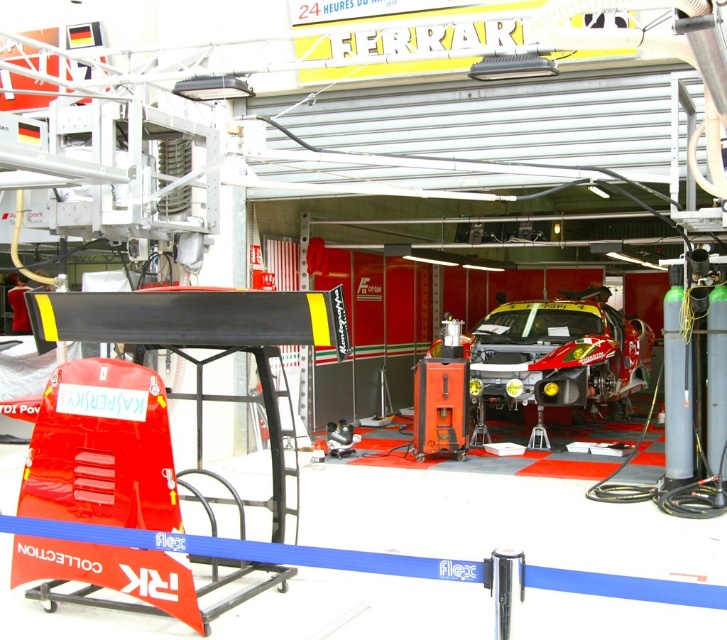
You are a photographer trying to capture a shot of the shiny silver car at center and the metallic silver mechanic at center. Since both are silver, you want to ensure the car is clearly visible in the photo. Based on their positions, which object should you focus on to make sure the car stands out?

The shiny silver car at center is positioned on the right side of the metallic silver mechanic at center. To make the car stand out, focus on the car since it is on the right side, which might be a more prominent position in the frame.

Where is the shiny silver car at center located in the garage? Please provide coordinates in the format of point followed by the coordinate values separated by commas.

The shiny silver car at center is located at point (558, 356).